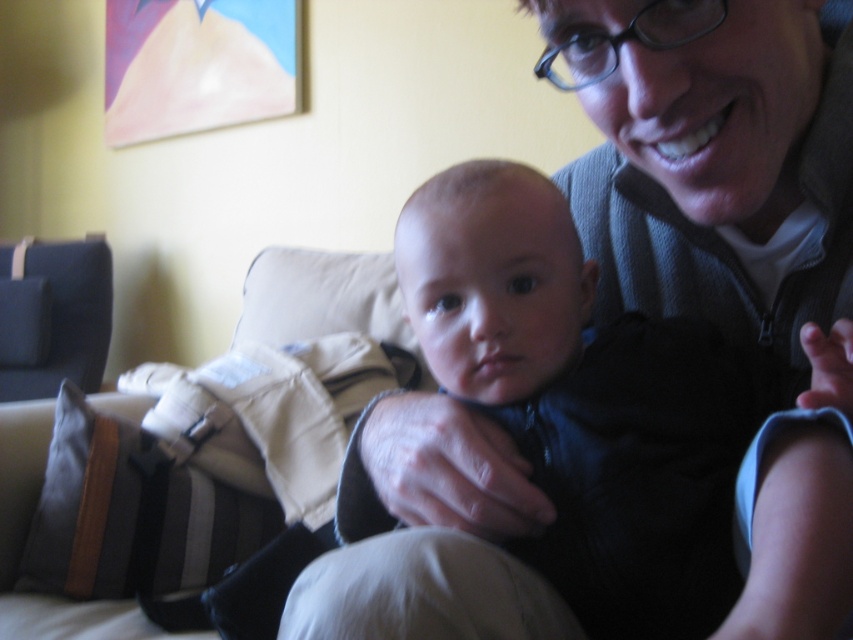
Between dark blue fabric baby at center and dark blue fabric armchair at left, which one is positioned higher?

dark blue fabric armchair at left

This screenshot has width=853, height=640. Describe the element at coordinates (492, 280) in the screenshot. I see `dark blue fabric baby at center` at that location.

Locate an element on the screen. Image resolution: width=853 pixels, height=640 pixels. dark blue fabric baby at center is located at coordinates (492, 280).